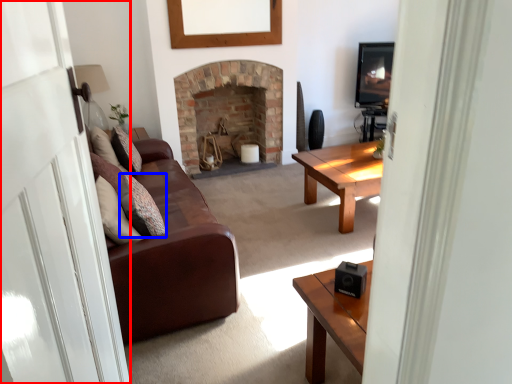
Question: Which object is further to the camera taking this photo, glass door (highlighted by a red box) or pillow (highlighted by a blue box)?

Choices:
 (A) glass door
 (B) pillow

Answer: (B)